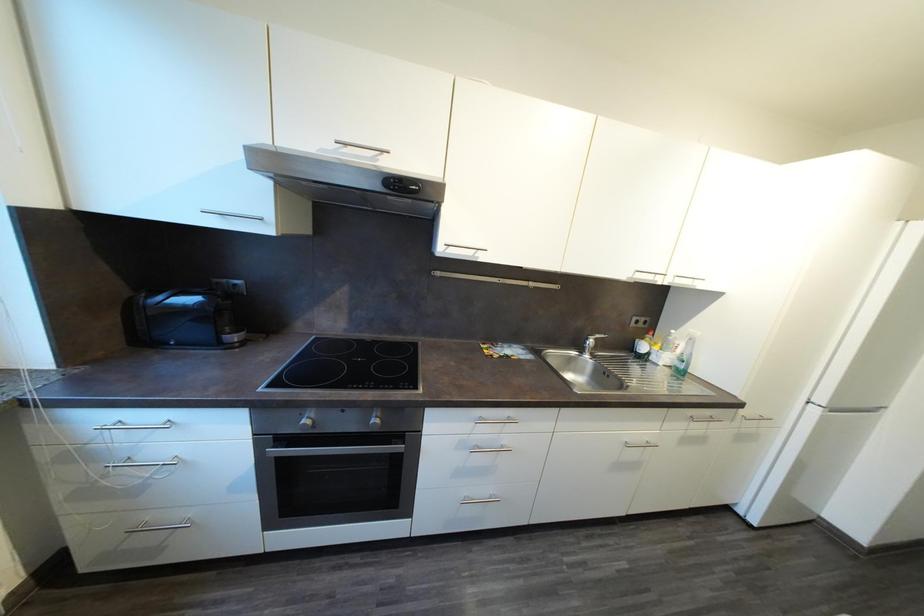
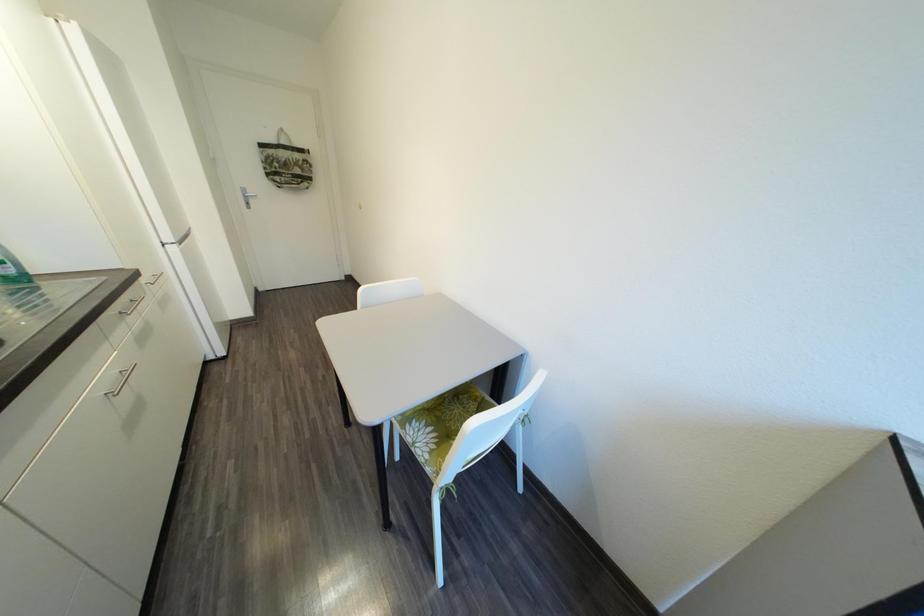
First-person continuous shooting, in which direction is the camera rotating?

The camera's rotation is toward right-down.